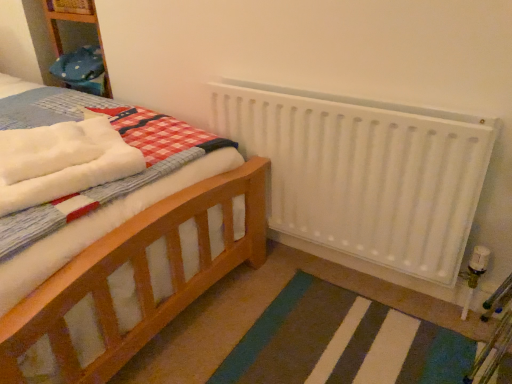
Question: Considering their positions, is white matte radiator at upper right located in front of or behind white fluffy bath towel at left?

Choices:
 (A) behind
 (B) front

Answer: (A)

Question: From a real-world perspective, is white matte radiator at upper right above or below white fluffy bath towel at left?

Choices:
 (A) below
 (B) above

Answer: (A)

Question: Based on their sizes in the image, would you say white matte radiator at upper right is bigger or smaller than white fluffy bath towel at left?

Choices:
 (A) big
 (B) small

Answer: (A)

Question: Is white fluffy bath towel at left wider or thinner than white matte radiator at upper right?

Choices:
 (A) thin
 (B) wide

Answer: (B)

Question: In terms of height, does white fluffy bath towel at left look taller or shorter compared to white matte radiator at upper right?

Choices:
 (A) short
 (B) tall

Answer: (A)

Question: From a real-world perspective, relative to white matte radiator at upper right, is white fluffy bath towel at left vertically above or below?

Choices:
 (A) above
 (B) below

Answer: (A)

Question: In the image, is white fluffy bath towel at left positioned in front of or behind white matte radiator at upper right?

Choices:
 (A) front
 (B) behind

Answer: (A)